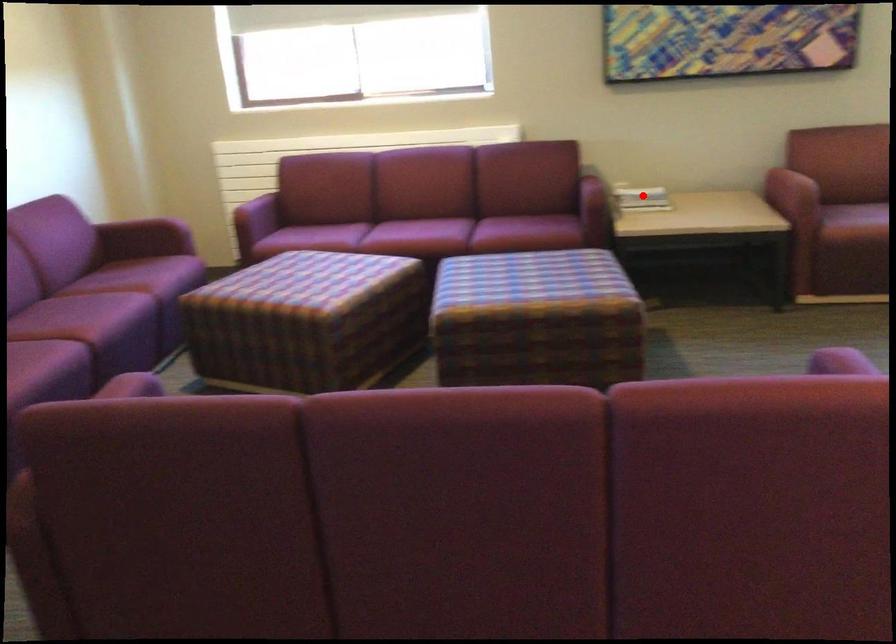
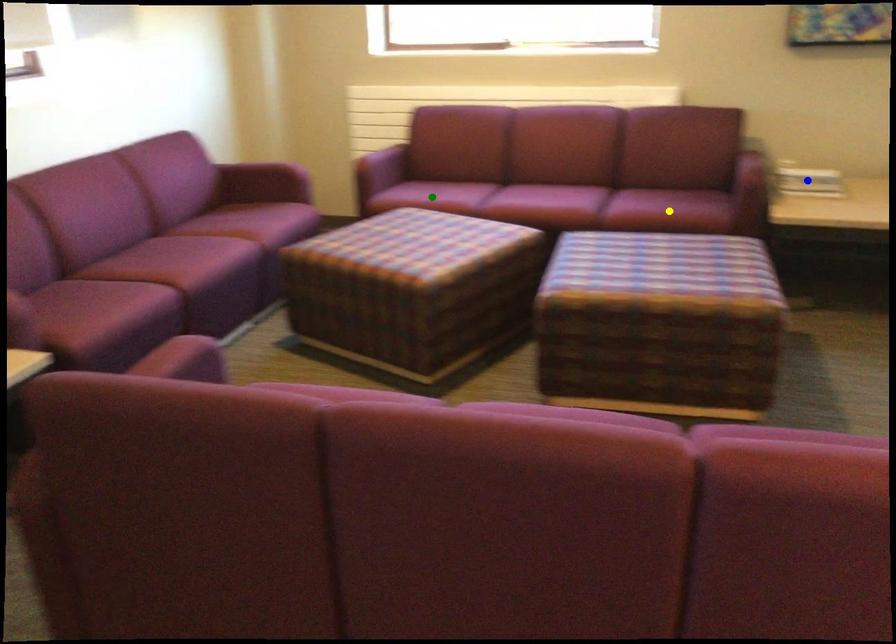
Question: I am providing you with two images of the same scene from different viewpoints. A red point is marked on the first image. You are given multiple points on the second image. Which point in image 2 is actually the same real-world point as the red point in image 1?

Choices:
 (A) green point
 (B) blue point
 (C) yellow point

Answer: (B)